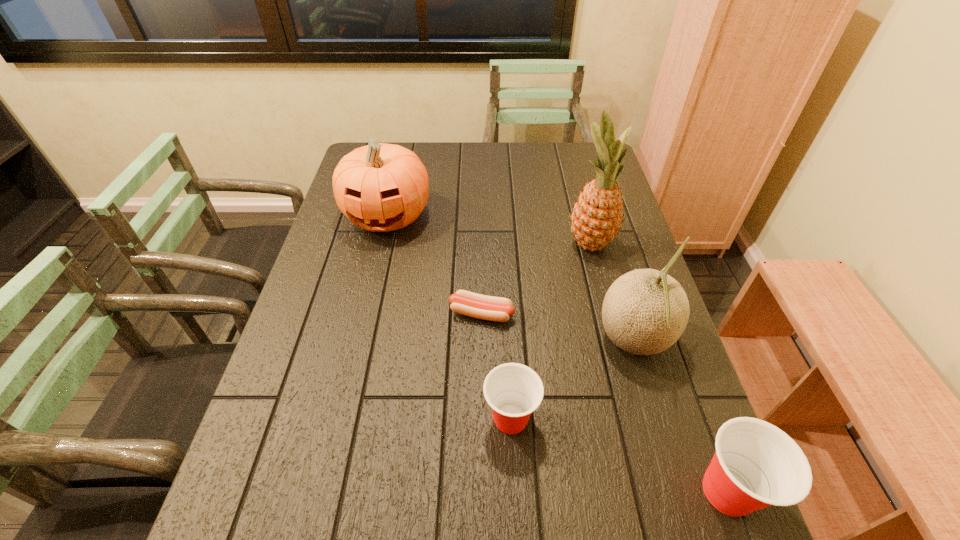
In the image, there is a desktop. In order to click on vacant area at the far edge in this screenshot , I will do `click(430, 163)`.

You are a GUI agent. You are given a task and a screenshot of the screen. Output one action in this format:
    pyautogui.click(x=<x>, y=<y>)
    Task: Click on the free location at the near edge of the desktop
    The width and height of the screenshot is (960, 540).
    Given the screenshot: What is the action you would take?
    pos(411,448)

Locate an element on the screen. The height and width of the screenshot is (540, 960). vacant space at the left edge of the desktop is located at coordinates click(290, 418).

Identify the location of free spot at the right edge of the desktop. The height and width of the screenshot is (540, 960). (585, 259).

Find the location of `vacant space at the far right corner`. vacant space at the far right corner is located at coordinates (561, 155).

This screenshot has height=540, width=960. Identify the location of unoccupied position between the shortest object and the left cup. (496, 366).

Find the location of a particular element. free point between the sausage and the cantaloup is located at coordinates (558, 327).

The width and height of the screenshot is (960, 540). In order to click on empty space that is in between the pineapple and the fourth tallest object in this screenshot , I will do `click(659, 367)`.

The image size is (960, 540). I want to click on free area in between the fourth tallest object and the shortest object, so click(x=605, y=402).

You are a GUI agent. You are given a task and a screenshot of the screen. Output one action in this format:
    pyautogui.click(x=<x>, y=<y>)
    Task: Click on the free space between the cantaloup and the left cup
    
    Given the screenshot: What is the action you would take?
    pyautogui.click(x=572, y=380)